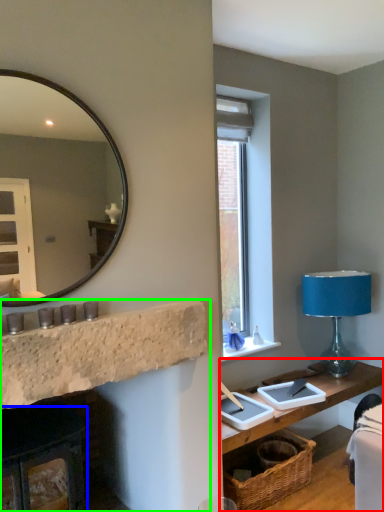
Question: Which is farther away from table (highlighted by a red box)? fireplace (highlighted by a blue box) or fireplace (highlighted by a green box)?

Choices:
 (A) fireplace
 (B) fireplace

Answer: (A)